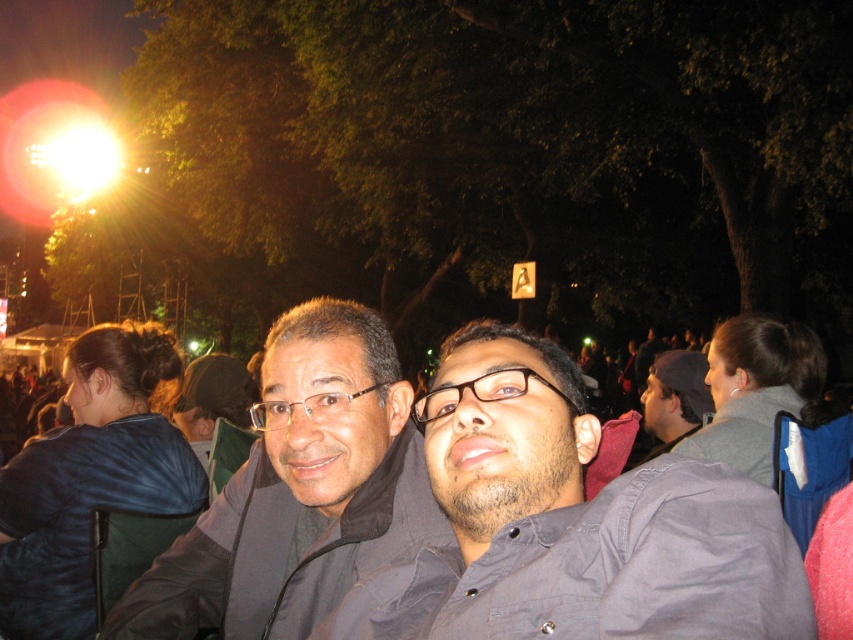
Question: Estimate the real-world distances between objects in this image. Which object is closer to the matte black jacket at center?

Choices:
 (A) blue fabric at center
 (B) dark gray shirt at center

Answer: (B)

Question: Does dark gray shirt at center have a lesser width compared to blue fabric at center?

Choices:
 (A) yes
 (B) no

Answer: (A)

Question: Does matte black jacket at center have a greater width compared to blue fabric at center?

Choices:
 (A) yes
 (B) no

Answer: (A)

Question: Which of the following is the farthest from the observer?

Choices:
 (A) (286, 593)
 (B) (172, 358)

Answer: (B)

Question: Which point is closer to the camera taking this photo?

Choices:
 (A) (476, 516)
 (B) (68, 467)

Answer: (A)

Question: Does dark gray shirt at center appear on the left side of matte black jacket at center?

Choices:
 (A) yes
 (B) no

Answer: (B)